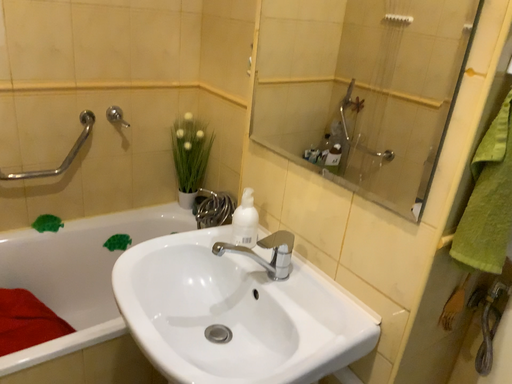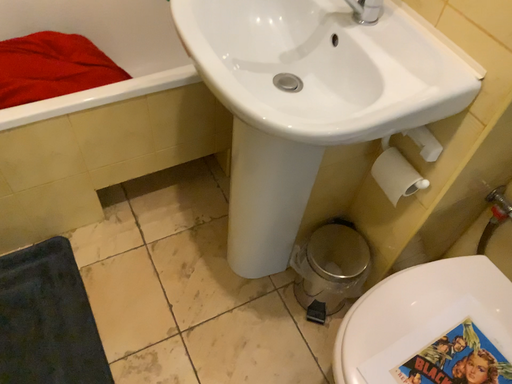
Question: Which way did the camera rotate in the video?

Choices:
 (A) rotated upward
 (B) rotated downward

Answer: (B)